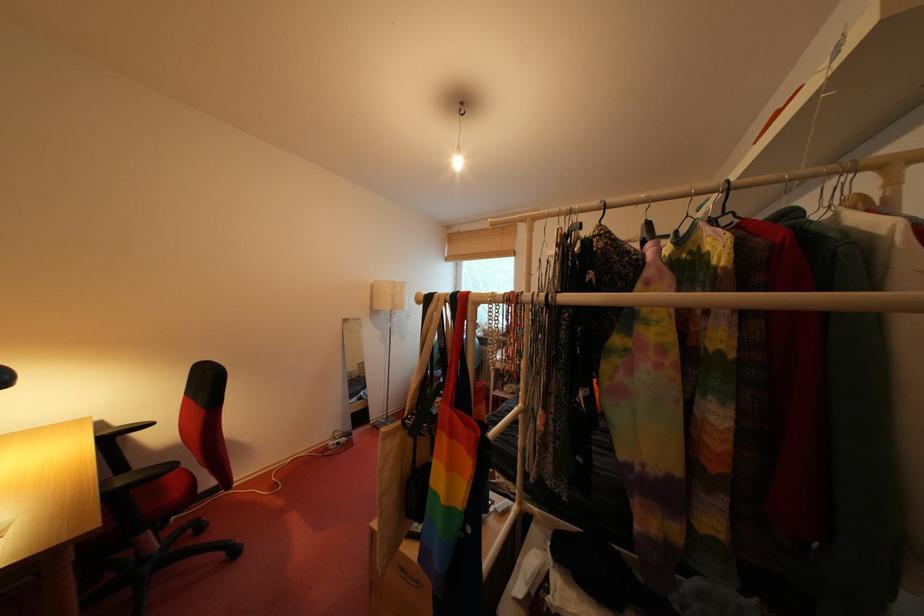
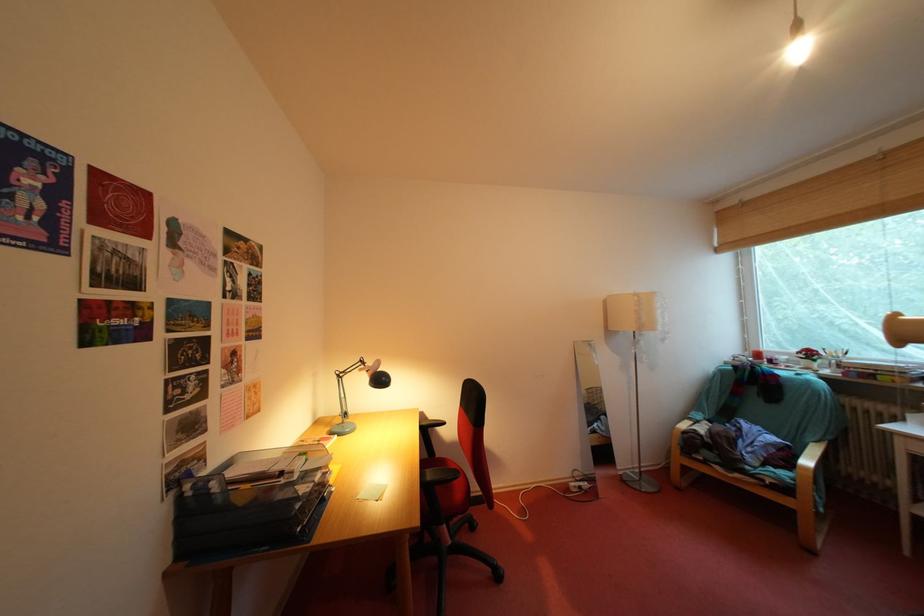
Question: The images are taken continuously from a first-person perspective. In which direction is your viewpoint rotating?

Choices:
 (A) Left
 (B) Right
 (C) Up
 (D) Down

Answer: (A)